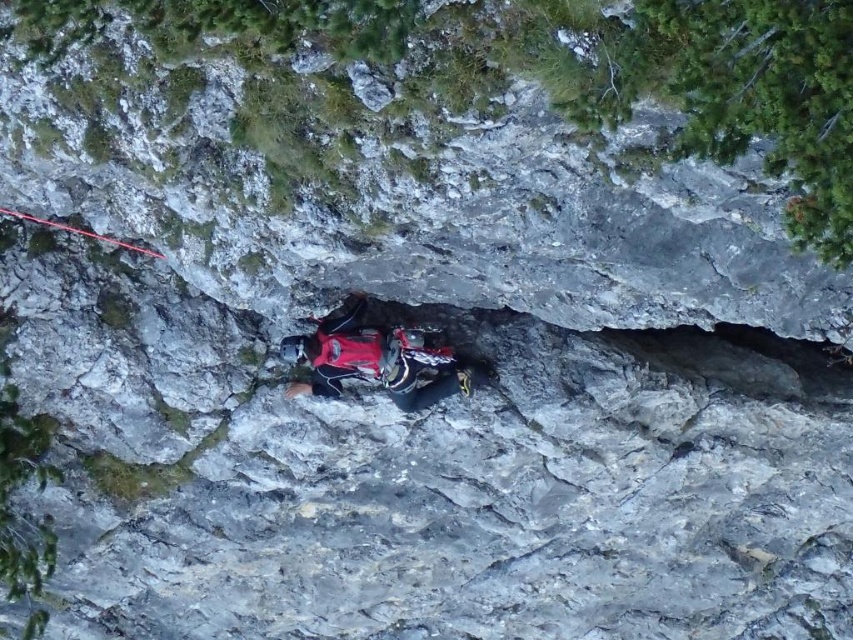
Is red fabric harness at center positioned in front of red nylon rope at upper left?

Yes, it is.

Locate an element on the screen. This screenshot has width=853, height=640. red fabric harness at center is located at coordinates (379, 358).

Locate an element on the screen. red fabric harness at center is located at coordinates (379, 358).